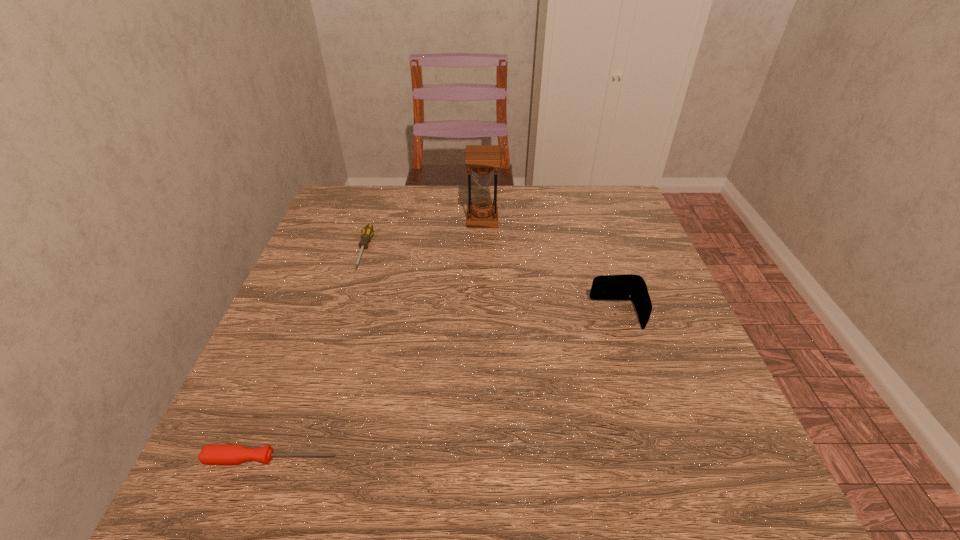
Where is `free spot between the second farthest object and the shorter screwdriver`? free spot between the second farthest object and the shorter screwdriver is located at coordinates (318, 354).

Identify the location of vacant space in between the second tallest object and the nearer screwdriver. This screenshot has height=540, width=960. (444, 387).

Where is `free space between the farther screwdriver and the tallest object`? This screenshot has height=540, width=960. free space between the farther screwdriver and the tallest object is located at coordinates (423, 235).

This screenshot has width=960, height=540. Find the location of `unoccupied area between the shortest object and the rightmost object`. unoccupied area between the shortest object and the rightmost object is located at coordinates (444, 387).

The image size is (960, 540). What are the coordinates of `vacant area that lies between the wallet and the second object from right to left` in the screenshot? It's located at (549, 267).

The height and width of the screenshot is (540, 960). I want to click on vacant area that lies between the tallest object and the third farthest object, so click(549, 267).

Where is `free spot between the nearest object and the second nearest object`? This screenshot has height=540, width=960. free spot between the nearest object and the second nearest object is located at coordinates (444, 387).

This screenshot has width=960, height=540. What are the coordinates of `object that is the third nearest to the third tallest object` in the screenshot? It's located at (631, 287).

This screenshot has width=960, height=540. Find the location of `the closest object to the shorter screwdriver`. the closest object to the shorter screwdriver is located at coordinates (367, 232).

At what (x,y) coordinates should I click in order to perform the action: click on free space that satisfies the following two spatial constraints: 1. at the tip of the taller screwdriver; 2. at the tip of the nearer screwdriver. Please return your answer as a coordinate pair (x, y). Looking at the image, I should click on (297, 458).